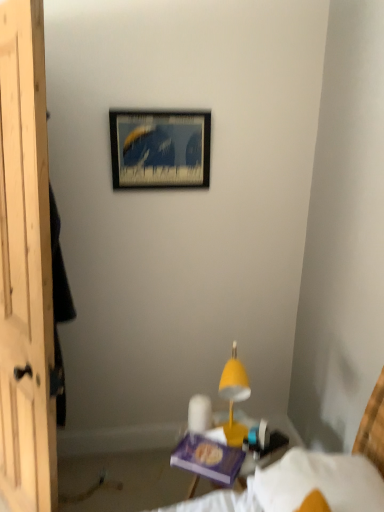
This screenshot has width=384, height=512. In order to click on wooden picture frame at upper center in this screenshot , I will do `click(160, 149)`.

This screenshot has height=512, width=384. In order to click on white fabric bed at lower right in this screenshot , I will do `click(318, 475)`.

Between point (236, 346) and point (370, 490), which one is positioned behind?

The point (236, 346) is farther from the camera.

Considering the positions of objects yellow matte table lamp at center and white fabric bed at lower right in the image provided, who is more to the left, yellow matte table lamp at center or white fabric bed at lower right?

From the viewer's perspective, yellow matte table lamp at center appears more on the left side.

Is yellow matte table lamp at center oriented away from white fabric bed at lower right?

No, yellow matte table lamp at center's orientation is not away from white fabric bed at lower right.

Based on their sizes in the image, would you say yellow matte table lamp at center is bigger or smaller than white fabric bed at lower right?

Clearly, yellow matte table lamp at center is smaller in size than white fabric bed at lower right.

From the picture: Does yellow matte table lamp at center have a greater width compared to wooden picture frame at upper center?

Indeed, yellow matte table lamp at center has a greater width compared to wooden picture frame at upper center.

Which is less distant, (231,422) or (209,117)?

Point (231,422) is closer to the camera than point (209,117).

Can you confirm if yellow matte table lamp at center is taller than wooden picture frame at upper center?

Yes, yellow matte table lamp at center is taller than wooden picture frame at upper center.

Which of these two, yellow matte table lamp at center or wooden picture frame at upper center, is smaller?

wooden picture frame at upper center.

Does wooden picture frame at upper center have a greater width compared to yellow matte table lamp at center?

In fact, wooden picture frame at upper center might be narrower than yellow matte table lamp at center.

Is wooden picture frame at upper center aimed at yellow matte table lamp at center?

No, wooden picture frame at upper center is not turned towards yellow matte table lamp at center.

Would you consider wooden picture frame at upper center to be distant from yellow matte table lamp at center?

No, wooden picture frame at upper center is not far from yellow matte table lamp at center.

Can you tell me how much wooden picture frame at upper center and yellow matte table lamp at center differ in facing direction?

The angle between the facing direction of wooden picture frame at upper center and the facing direction of yellow matte table lamp at center is 107 degrees.

Considering the positions of objects white fabric bed at lower right and wooden picture frame at upper center in the image provided, who is behind, white fabric bed at lower right or wooden picture frame at upper center?

wooden picture frame at upper center is further away from the camera.

In the scene shown: How far apart are white fabric bed at lower right and wooden picture frame at upper center?

1.28 meters.

Can you confirm if white fabric bed at lower right is thinner than wooden picture frame at upper center?

No, white fabric bed at lower right is not thinner than wooden picture frame at upper center.

Is white fabric bed at lower right not close to wooden picture frame at upper center?

Absolutely, white fabric bed at lower right is distant from wooden picture frame at upper center.

From a real-world perspective, is white fabric bed at lower right located higher than yellow matte table lamp at center?

No, from a real-world perspective, white fabric bed at lower right is not above yellow matte table lamp at center.

How different are the orientations of white fabric bed at lower right and yellow matte table lamp at center in degrees?

9.5 degrees separate the facing orientations of white fabric bed at lower right and yellow matte table lamp at center.

Does white fabric bed at lower right turn towards yellow matte table lamp at center?

No, white fabric bed at lower right is not oriented towards yellow matte table lamp at center.

Can you confirm if white fabric bed at lower right is bigger than yellow matte table lamp at center?

Correct, white fabric bed at lower right is larger in size than yellow matte table lamp at center.

Considering the sizes of objects wooden picture frame at upper center and white fabric bed at lower right in the image provided, who is smaller, wooden picture frame at upper center or white fabric bed at lower right?

With smaller size is wooden picture frame at upper center.

Considering the sizes of objects wooden picture frame at upper center and white fabric bed at lower right in the image provided, who is shorter, wooden picture frame at upper center or white fabric bed at lower right?

wooden picture frame at upper center is shorter.

Is wooden picture frame at upper center turned away from white fabric bed at lower right?

That's not correct — wooden picture frame at upper center is not looking away from white fabric bed at lower right.

Are wooden picture frame at upper center and white fabric bed at lower right located far from each other?

wooden picture frame at upper center is positioned a significant distance from white fabric bed at lower right.

At what (x,y) coordinates should I click in order to perform the action: click on bed on the right of yellow matte table lamp at center. Please return your answer as a coordinate pair (x, y). This screenshot has width=384, height=512. Looking at the image, I should click on (318, 475).

At what (x,y) coordinates should I click in order to perform the action: click on picture frame on the left of yellow matte table lamp at center. Please return your answer as a coordinate pair (x, y). The width and height of the screenshot is (384, 512). Looking at the image, I should click on (160, 149).

Considering their positions, is wooden picture frame at upper center positioned closer to yellow matte table lamp at center than white fabric bed at lower right?

Among the two, white fabric bed at lower right is located nearer to yellow matte table lamp at center.

Based on their spatial positions, is yellow matte table lamp at center or wooden picture frame at upper center closer to white fabric bed at lower right?

yellow matte table lamp at center lies closer to white fabric bed at lower right than the other object.

Based on their spatial positions, is yellow matte table lamp at center or white fabric bed at lower right closer to wooden picture frame at upper center?

Among the two, yellow matte table lamp at center is located nearer to wooden picture frame at upper center.

Estimate the real-world distances between objects in this image. Which object is further from wooden picture frame at upper center, white fabric bed at lower right or yellow matte table lamp at center?

The object further to wooden picture frame at upper center is white fabric bed at lower right.

Estimate the real-world distances between objects in this image. Which object is closer to yellow matte table lamp at center, white fabric bed at lower right or wooden picture frame at upper center?

white fabric bed at lower right is closer to yellow matte table lamp at center.

Estimate the real-world distances between objects in this image. Which object is closer to white fabric bed at lower right, wooden picture frame at upper center or yellow matte table lamp at center?

Among the two, yellow matte table lamp at center is located nearer to white fabric bed at lower right.

I want to click on table lamp that lies between wooden picture frame at upper center and white fabric bed at lower right from top to bottom, so click(234, 396).